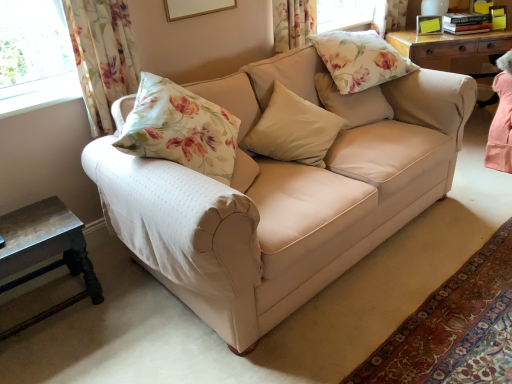
Question: Should I look upward or downward to see floral fabric pillow at upper center, placed as the third pillow when sorted from bottom to top?

Choices:
 (A) up
 (B) down

Answer: (A)

Question: Can you confirm if rustic wood side table at lower left is taller than floral fabric pillow at upper center, placed as the third pillow when sorted from bottom to top?

Choices:
 (A) yes
 (B) no

Answer: (A)

Question: Considering the relative positions of rustic wood side table at lower left and floral fabric pillow at upper center, the first pillow viewed from the top, in the image provided, is rustic wood side table at lower left to the right of floral fabric pillow at upper center, the first pillow viewed from the top, from the viewer's perspective?

Choices:
 (A) yes
 (B) no

Answer: (B)

Question: Is rustic wood side table at lower left not close to floral fabric pillow at upper center, the first pillow viewed from the top?

Choices:
 (A) yes
 (B) no

Answer: (A)

Question: From the image's perspective, would you say rustic wood side table at lower left is shown under floral fabric pillow at upper center, the first pillow viewed from the top?

Choices:
 (A) no
 (B) yes

Answer: (B)

Question: Is rustic wood side table at lower left thinner than floral fabric pillow at upper center, placed as the third pillow when sorted from bottom to top?

Choices:
 (A) yes
 (B) no

Answer: (A)

Question: Is rustic wood side table at lower left further to the viewer compared to floral fabric pillow at upper center, placed as the third pillow when sorted from bottom to top?

Choices:
 (A) no
 (B) yes

Answer: (A)

Question: Is beige fabric pillow at center, placed as the 3th pillow when sorted from top to bottom, closer to camera compared to beige fabric couch at center?

Choices:
 (A) no
 (B) yes

Answer: (A)

Question: From a real-world perspective, is beige fabric pillow at center, placed as the 3th pillow when sorted from top to bottom, on beige fabric couch at center?

Choices:
 (A) yes
 (B) no

Answer: (A)

Question: Considering the relative sizes of beige fabric pillow at center, placed as the 3th pillow when sorted from top to bottom, and beige fabric couch at center in the image provided, is beige fabric pillow at center, placed as the 3th pillow when sorted from top to bottom, smaller than beige fabric couch at center?

Choices:
 (A) no
 (B) yes

Answer: (B)

Question: Is beige fabric pillow at center, placed as the 3th pillow when sorted from top to bottom, turned away from beige fabric couch at center?

Choices:
 (A) yes
 (B) no

Answer: (A)

Question: Is beige fabric pillow at center, placed as the 3th pillow when sorted from top to bottom, with beige fabric couch at center?

Choices:
 (A) no
 (B) yes

Answer: (A)

Question: Is beige fabric pillow at center, placed as the 3th pillow when sorted from top to bottom, at the left side of beige fabric couch at center?

Choices:
 (A) yes
 (B) no

Answer: (A)

Question: Considering the relative sizes of rustic wood side table at lower left and beige fabric couch at center in the image provided, is rustic wood side table at lower left thinner than beige fabric couch at center?

Choices:
 (A) no
 (B) yes

Answer: (B)